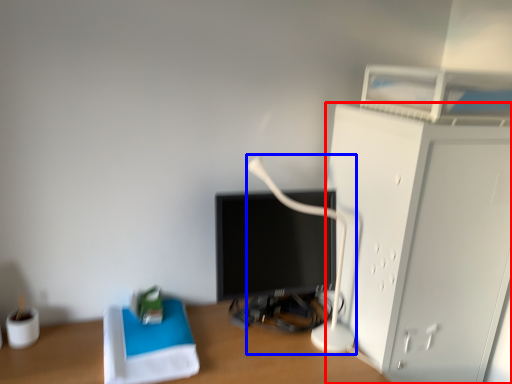
Question: Which of the following is the farthest to the observer, furniture (highlighted by a red box) or table lamp (highlighted by a blue box)?

Choices:
 (A) furniture
 (B) table lamp

Answer: (B)